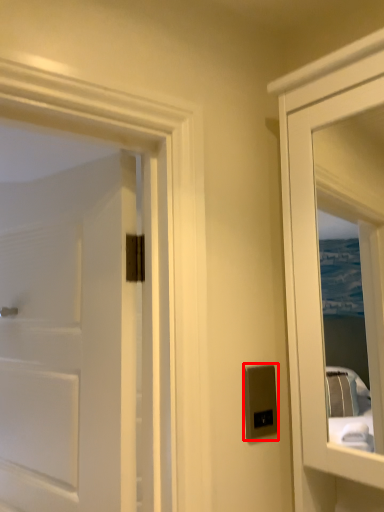
Question: From the image's perspective, where is electric outlet (annotated by the red box) located in relation to door in the image?

Choices:
 (A) below
 (B) above

Answer: (A)